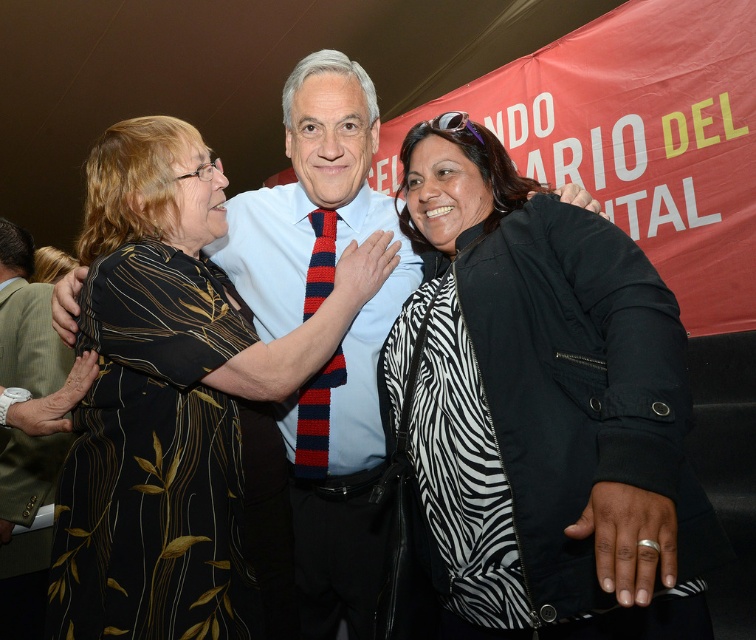
What do you see at coordinates (172, 396) in the screenshot? This screenshot has height=640, width=756. I see `black printed dress at center` at bounding box center [172, 396].

Is black printed dress at center bigger than knitted red and navy striped tie at center?

Yes.

What do you see at coordinates (172, 396) in the screenshot? The width and height of the screenshot is (756, 640). I see `black printed dress at center` at bounding box center [172, 396].

Where is `black printed dress at center`? black printed dress at center is located at coordinates (172, 396).

In the scene shown: Which is below, zebra print jacket at center or black printed dress at center?

zebra print jacket at center

Can you confirm if zebra print jacket at center is bigger than black printed dress at center?

→ Correct, zebra print jacket at center is larger in size than black printed dress at center.

Find the location of a particular element. zebra print jacket at center is located at coordinates (541, 408).

Is zebra print jacket at center below knitted red and navy striped tie at center?

Correct, zebra print jacket at center is located below knitted red and navy striped tie at center.

Does zebra print jacket at center have a greater width compared to knitted red and navy striped tie at center?

Correct, the width of zebra print jacket at center exceeds that of knitted red and navy striped tie at center.

Is point (513, 348) positioned after point (339, 380)?

That is False.

The width and height of the screenshot is (756, 640). In order to click on zebra print jacket at center in this screenshot , I will do `click(541, 408)`.